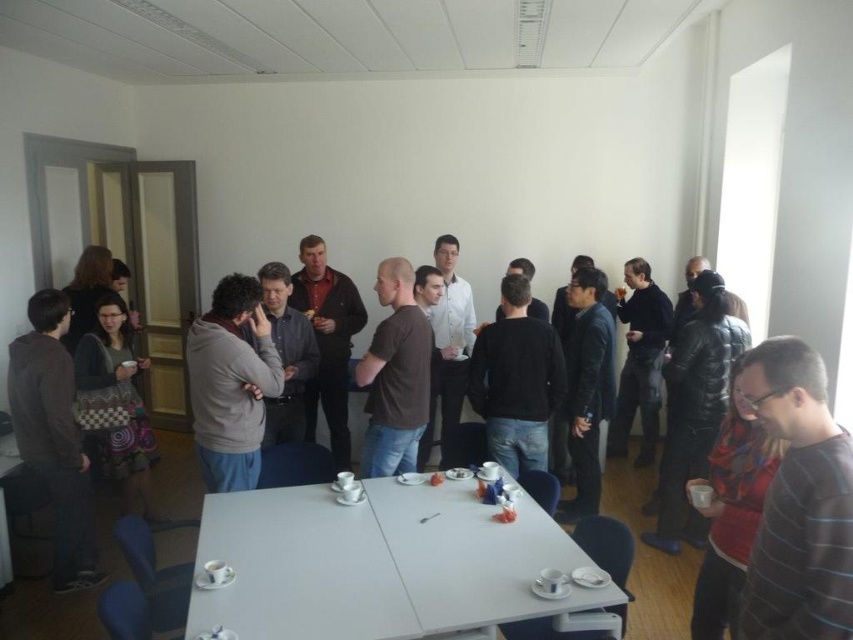
What do you see at coordinates (378, 563) in the screenshot? I see `white glossy table at center` at bounding box center [378, 563].

Is white glossy table at center positioned before gray fleece jacket at center?

That is True.

Where is `white glossy table at center`? The width and height of the screenshot is (853, 640). white glossy table at center is located at coordinates (378, 563).

Between point (230, 596) and point (117, 472), which one is positioned behind?

Point (117, 472)

Which is more to the left, white glossy table at center or knitted sweater at center?

From the viewer's perspective, knitted sweater at center appears more on the left side.

Is point (610, 593) farther from camera compared to point (141, 445)?

That is False.

At what (x,y) coordinates should I click in order to perform the action: click on white glossy table at center. Please return your answer as a coordinate pair (x, y). This screenshot has height=640, width=853. Looking at the image, I should click on (378, 563).

Does matte gray hoodie at left have a smaller size compared to dark gray sweater at center?

Incorrect, matte gray hoodie at left is not smaller in size than dark gray sweater at center.

Locate an element on the screen. This screenshot has width=853, height=640. matte gray hoodie at left is located at coordinates (53, 436).